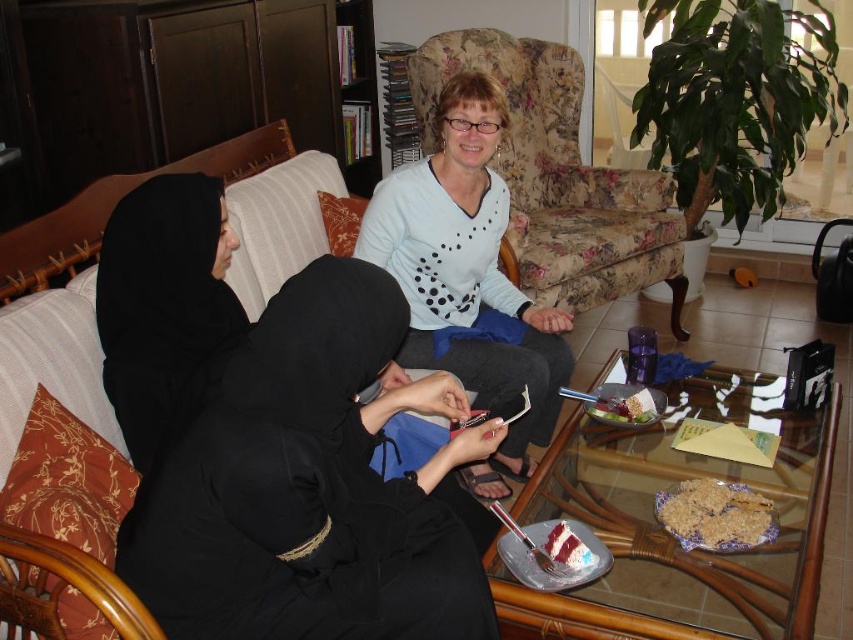
Based on the scene description, which object is positioned to the right of the other between the floral fabric armchair at center and the strawberry cake at center?

The floral fabric armchair at center is positioned to the right of the strawberry cake at center.

You are a guest at a dinner party and see the transparent glass table at center and the crumbly brown cake at lower center. Which object is located above the other?

The transparent glass table at center is positioned over crumbly brown cake at lower center.